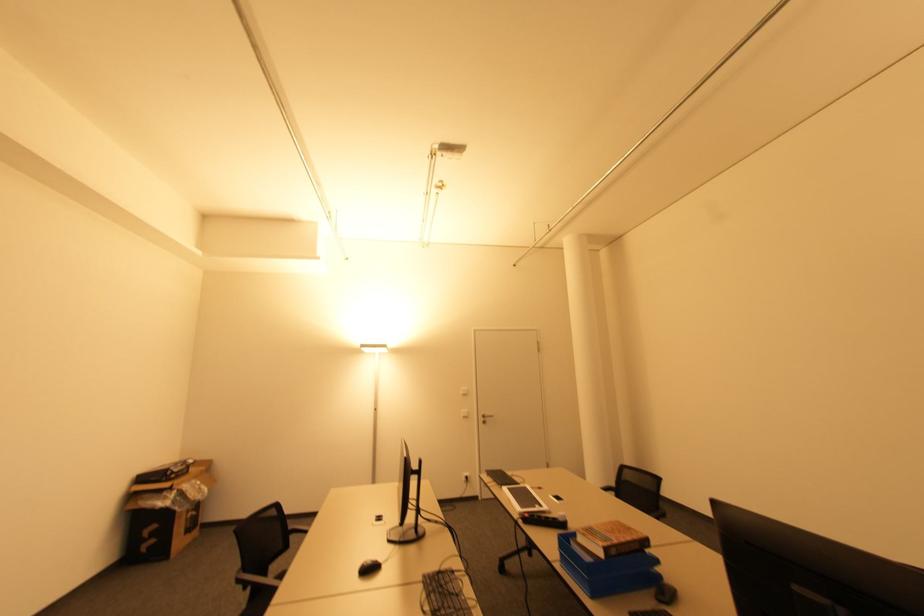
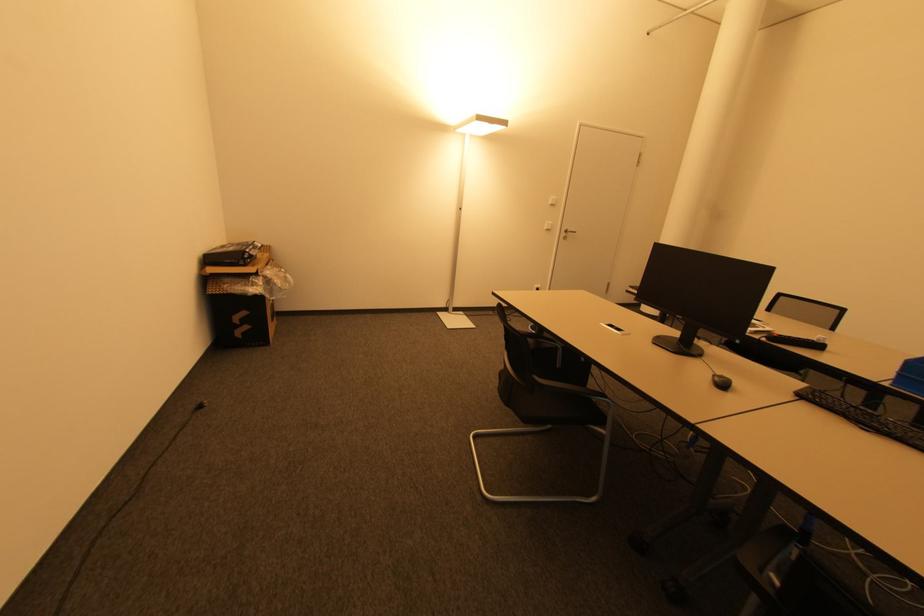
Where in the second image is the point corresponding to [483,419] from the first image?

(565, 235)